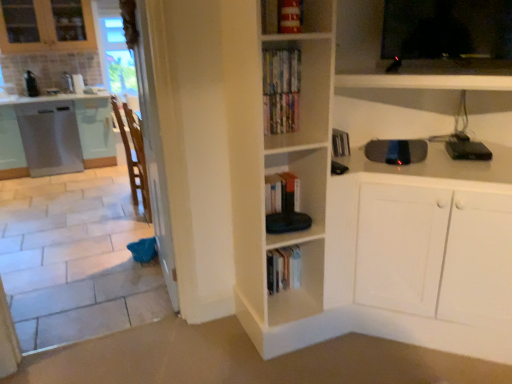
The image size is (512, 384). I want to click on free space underneath brown wooden chair at left (from a real-world perspective), so click(140, 219).